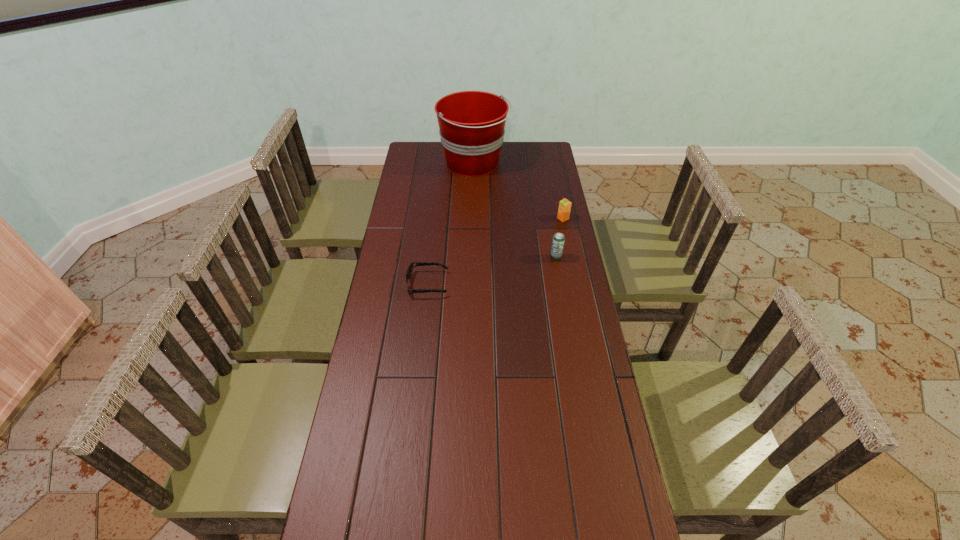
Where is `the tallest object`? The width and height of the screenshot is (960, 540). the tallest object is located at coordinates (471, 123).

The image size is (960, 540). What are the coordinates of `bucket` in the screenshot? It's located at (471, 123).

You are a GUI agent. You are given a task and a screenshot of the screen. Output one action in this format:
    pyautogui.click(x=<x>, y=<y>)
    Task: Click on the third farthest object
    
    Given the screenshot: What is the action you would take?
    pyautogui.click(x=558, y=240)

Where is `the third object from left to right`? the third object from left to right is located at coordinates pyautogui.click(x=558, y=240).

At what (x,y) coordinates should I click in order to perform the action: click on orange juice. Please return your answer as a coordinate pair (x, y). Looking at the image, I should click on (564, 209).

The height and width of the screenshot is (540, 960). I want to click on the third nearest object, so click(x=564, y=209).

Where is `the shortest object`? the shortest object is located at coordinates (409, 271).

Find the location of `sunglasses`. sunglasses is located at coordinates (409, 271).

Locate an element on the screen. The image size is (960, 540). free point located 0.120m on the right of the tallest object is located at coordinates (534, 163).

The image size is (960, 540). In order to click on vacant space situated 0.280m on the back of the beer can in this screenshot , I will do `click(547, 210)`.